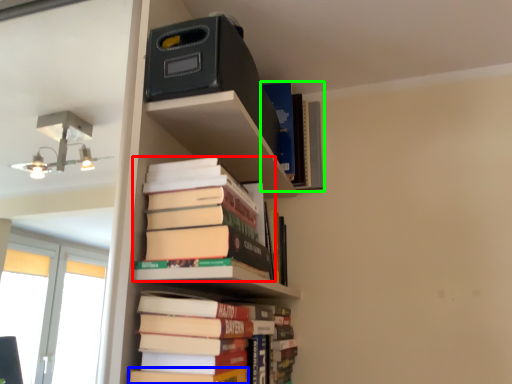
Question: Which is farther away from book (highlighted by a red box)? paperback book (highlighted by a blue box) or book (highlighted by a green box)?

Choices:
 (A) paperback book
 (B) book

Answer: (B)